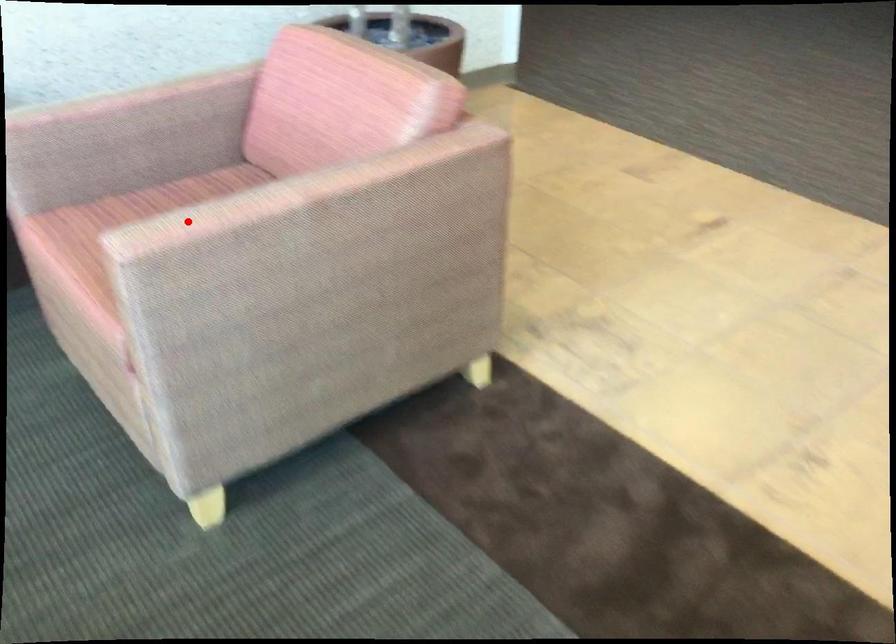
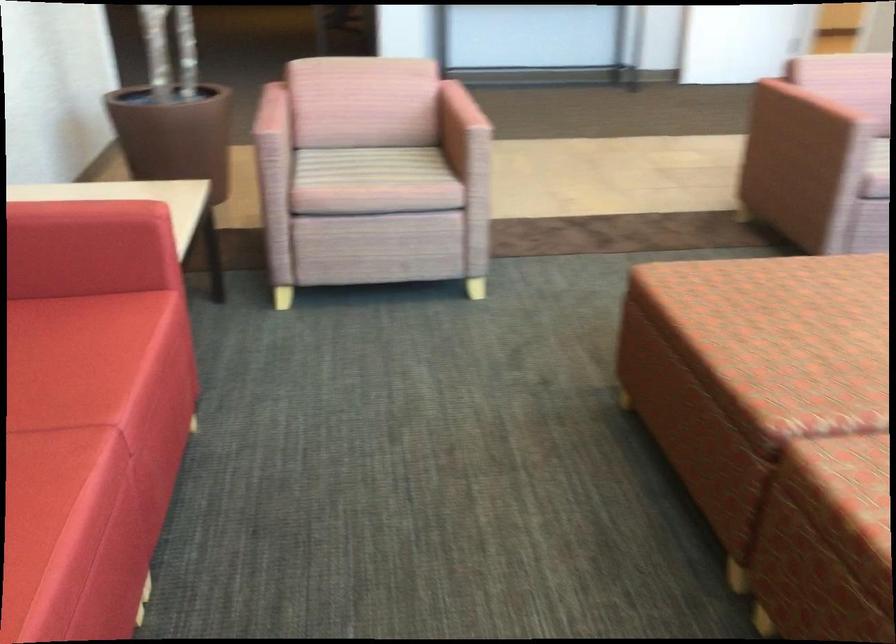
Question: I am providing you with two images of the same scene from different viewpoints. A red point is shown in image1. For the corresponding object point in image2, is it positioned nearer or farther from the camera?

Choices:
 (A) Nearer
 (B) Farther

Answer: (B)